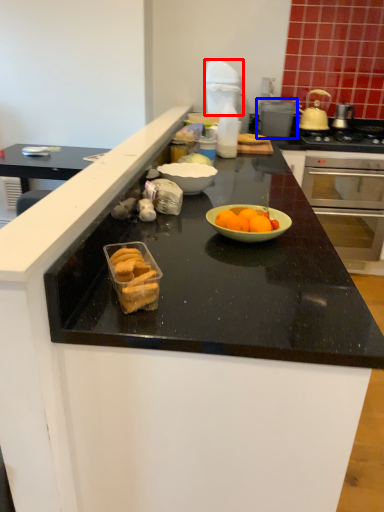
Question: Which object appears closest to the camera in this image, kitchen appliance (highlighted by a red box) or appliance (highlighted by a blue box)?

Choices:
 (A) kitchen appliance
 (B) appliance

Answer: (A)